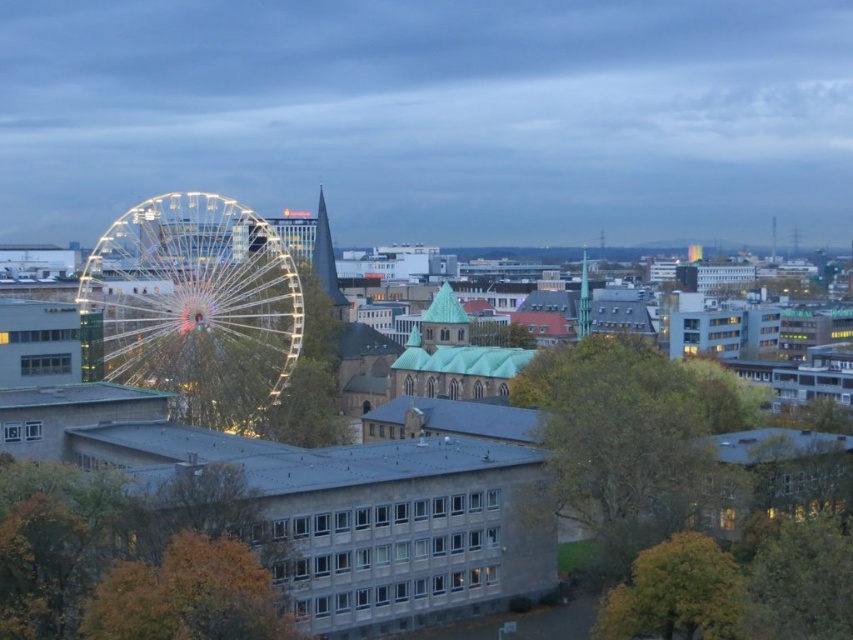
Question: Among these points, which one is farthest from the camera?

Choices:
 (A) (289, 333)
 (B) (231, 500)
 (C) (558, 412)
 (D) (645, 600)

Answer: (A)

Question: Is brown leafy tree at lower left positioned behind yellow-green leafy tree at lower right?

Choices:
 (A) yes
 (B) no

Answer: (B)

Question: Can you confirm if brown leafy tree at lower left is positioned below green leafy tree at center?

Choices:
 (A) yes
 (B) no

Answer: (A)

Question: Which object is positioned closest to the illuminated steel ferris wheel at left?

Choices:
 (A) brown leafy tree at lower left
 (B) yellow-green leafy tree at lower right
 (C) green leafy tree at center

Answer: (C)

Question: Which object appears closest to the camera in this image?

Choices:
 (A) brown leafy tree at lower left
 (B) yellow-green leafy tree at lower right
 (C) green leafy tree at center
 (D) illuminated steel ferris wheel at left

Answer: (A)

Question: From the image, what is the correct spatial relationship of brown leafy tree at lower left in relation to yellow-green leafy tree at lower right?

Choices:
 (A) left
 (B) right

Answer: (A)